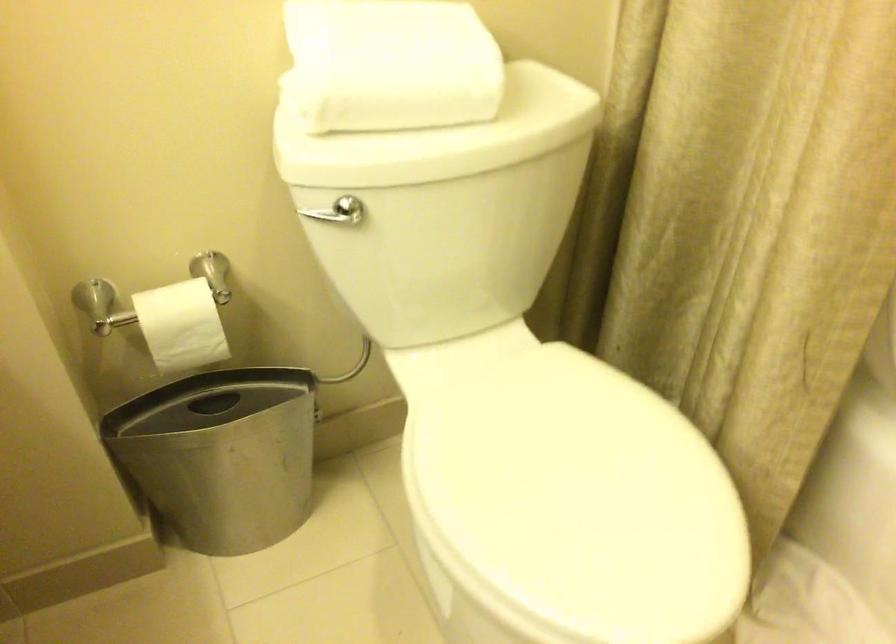
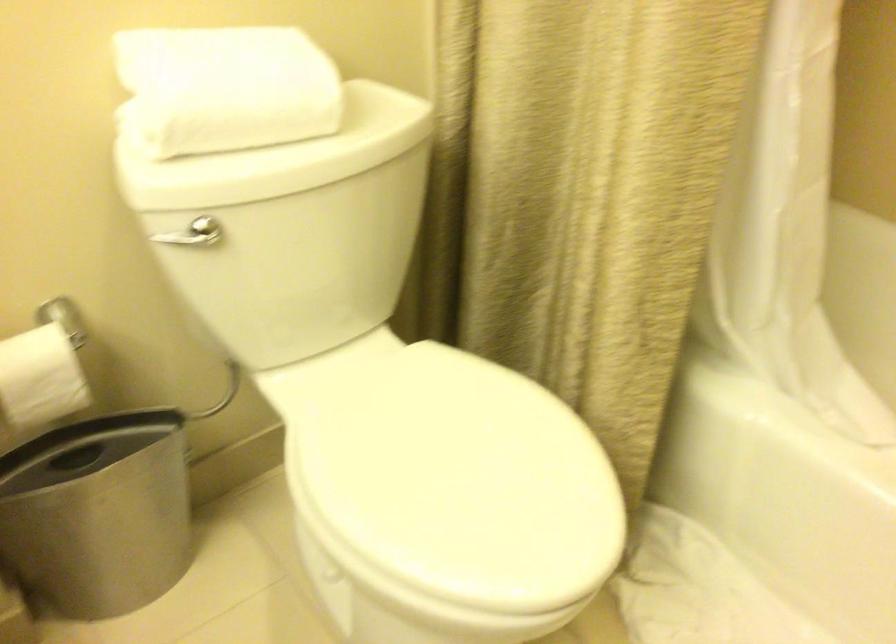
Question: The images are taken continuously from a first-person perspective. In which direction is your viewpoint rotating?

Choices:
 (A) Left
 (B) Right
 (C) Up
 (D) Down

Answer: (B)